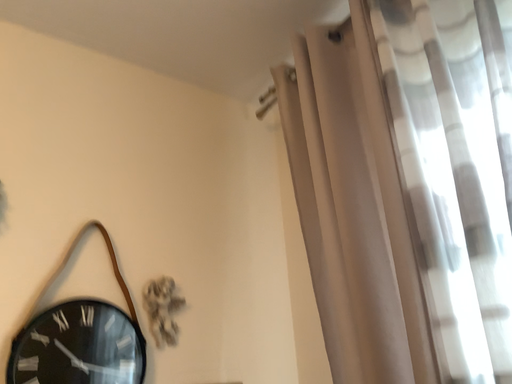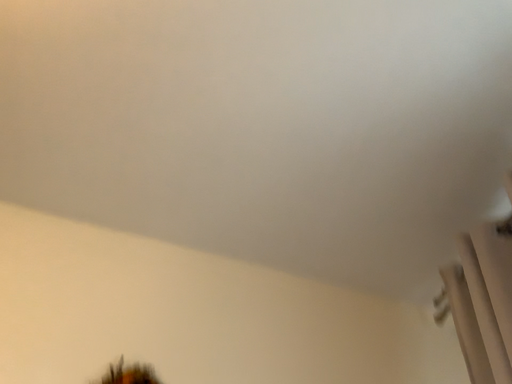
Question: Which way did the camera rotate in the video?

Choices:
 (A) rotated downward
 (B) rotated upward

Answer: (B)